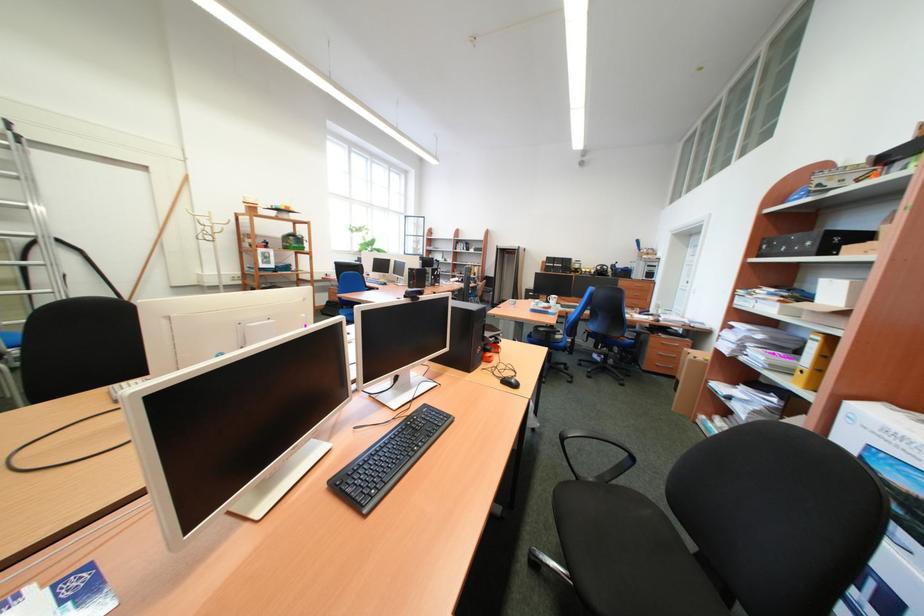
This screenshot has width=924, height=616. What do you see at coordinates (688, 381) in the screenshot?
I see `a cardboard box` at bounding box center [688, 381].